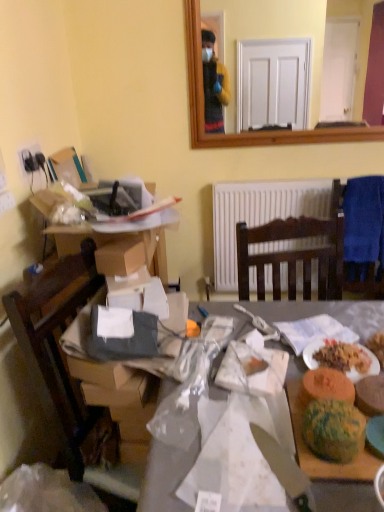
At what (x,y) coordinates should I click in order to perform the action: click on free space to the back side of silver metallic knife at center. Please return your answer as a coordinate pair (x, y). Image resolution: width=384 pixels, height=512 pixels. Looking at the image, I should click on (237, 417).